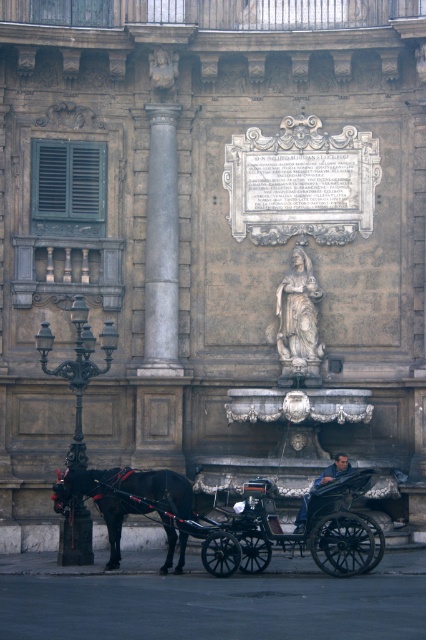
Between shiny black horse at left and white marble statue at center, which one has less height?

Standing shorter between the two is shiny black horse at left.

Can you confirm if shiny black horse at left is positioned below white marble statue at center?

Correct, shiny black horse at left is located below white marble statue at center.

Identify the location of shiny black horse at left. The height and width of the screenshot is (640, 426). (129, 500).

What do you see at coordinates (129, 500) in the screenshot?
I see `shiny black horse at left` at bounding box center [129, 500].

Between shiny black horse at left and blue denim jeans at lower center, which one is positioned higher?

blue denim jeans at lower center is above.

Where is `shiny black horse at left`? shiny black horse at left is located at coordinates (129, 500).

Which is behind, point (293, 259) or point (305, 504)?

The point (293, 259) is more distant.

What do you see at coordinates (299, 314) in the screenshot? The height and width of the screenshot is (640, 426). I see `white marble statue at center` at bounding box center [299, 314].

Locate an element on the screen. This screenshot has width=426, height=640. white marble statue at center is located at coordinates (299, 314).